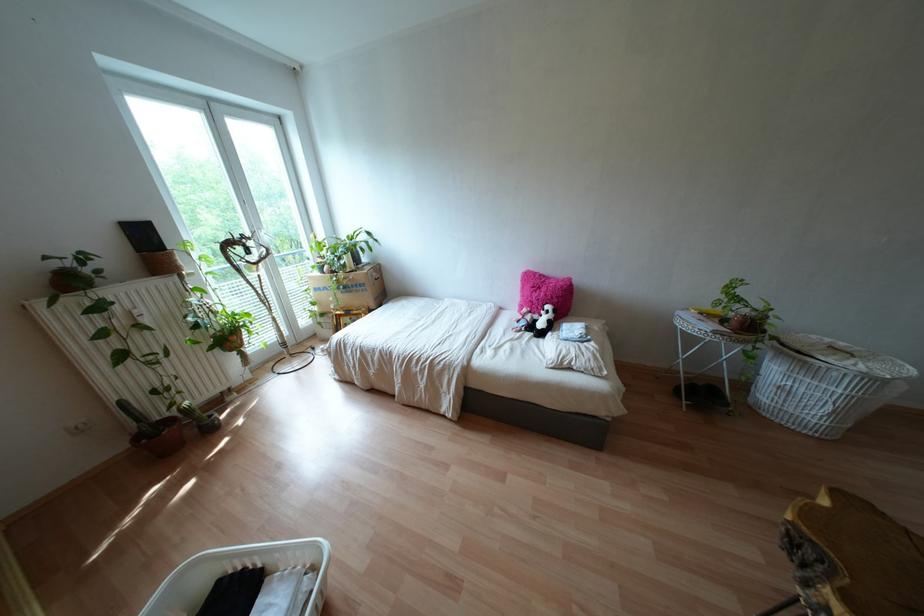
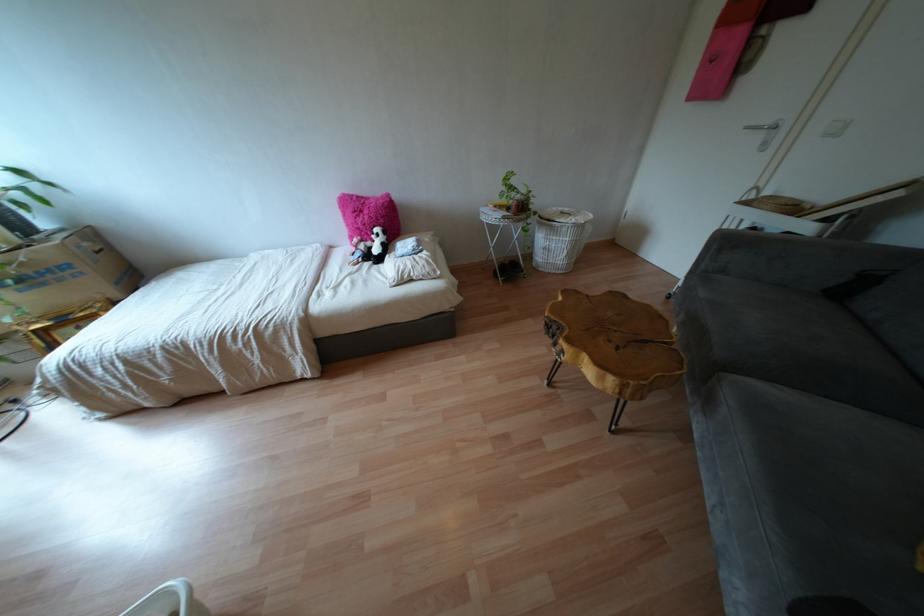
The first image is from the beginning of the video and the second image is from the end. How did the camera likely rotate when shooting the video?

The rotation direction of the camera is right-down.